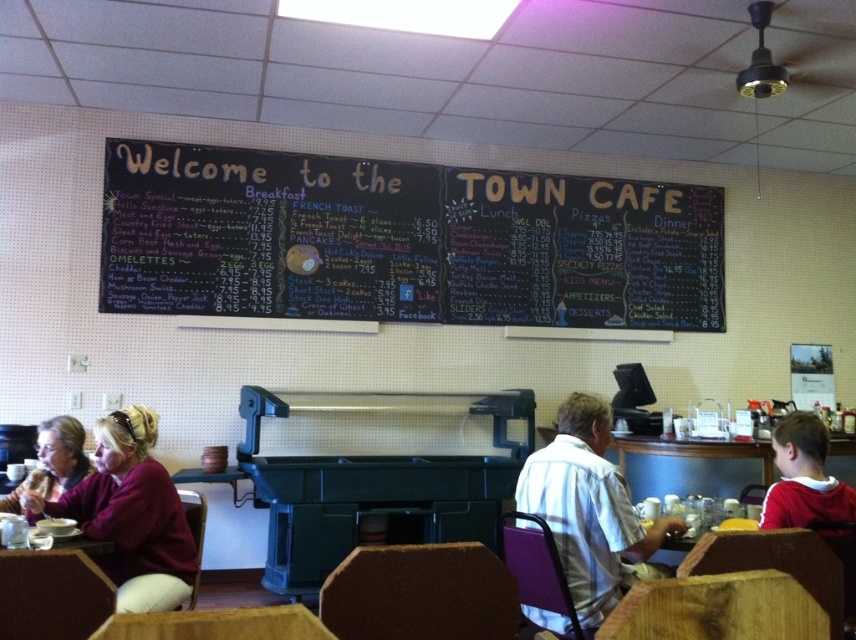
You are a customer at Town Cafe and want to take a photo of the menu. You notice two points in the image labeled as point 1 and point 2. Point 1 is at coordinates point [90,506] and point 2 is at point [813,513]. Which point should you focus on to ensure the menu is in sharp focus?

You should focus on point 1 at coordinates point [90,506] because it is closer to the camera compared to point 2 at point [813,513], ensuring the menu will be in sharp focus.

You are a customer at Town Cafe and you want to order a drink from the menu. The menu is on the wall, and there is a white striped shirt at center. Where should you look to find the drink options on the menu?

The menu at Town Cafe lists drink options in its sections, so you should look at the menu sections like breakfast, lunch, dinner, or desserts where drinks might be listed.